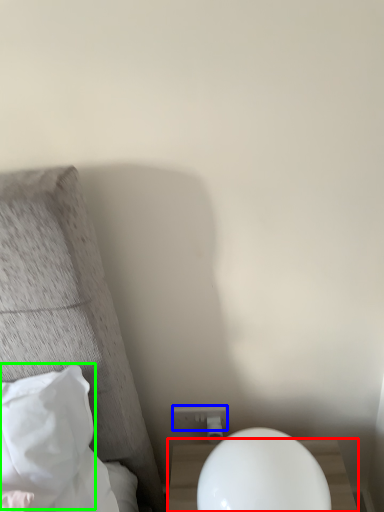
Question: Based on their relative distances, which object is nearer to nightstand (highlighted by a red box)? Choose from electric outlet (highlighted by a blue box) and pillow (highlighted by a green box).

Choices:
 (A) electric outlet
 (B) pillow

Answer: (A)